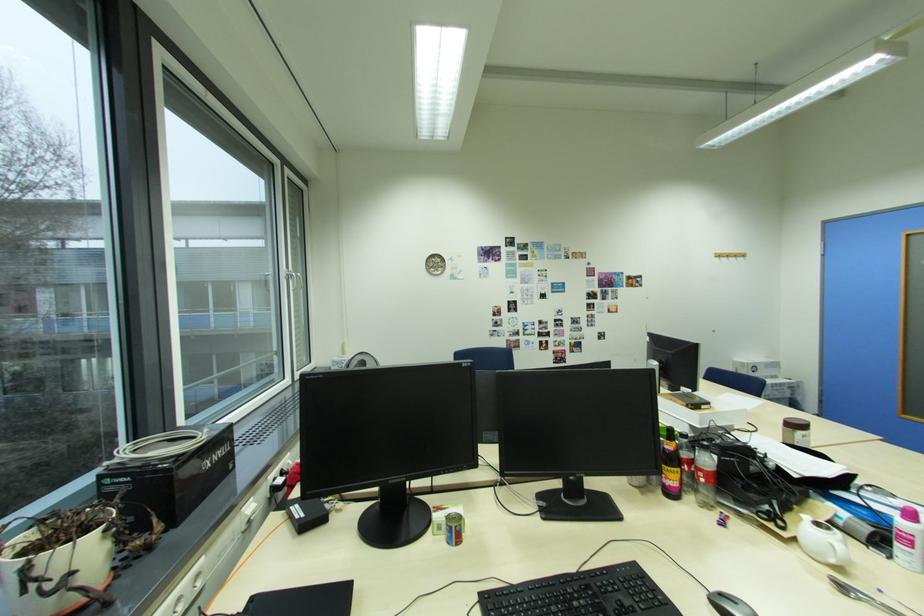
Find the location of a particular element. white plant pot is located at coordinates (56, 572).